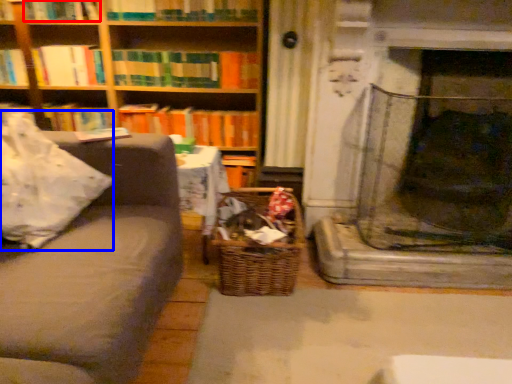
Question: Among these objects, which one is farthest to the camera, book (highlighted by a red box) or pillow (highlighted by a blue box)?

Choices:
 (A) book
 (B) pillow

Answer: (A)